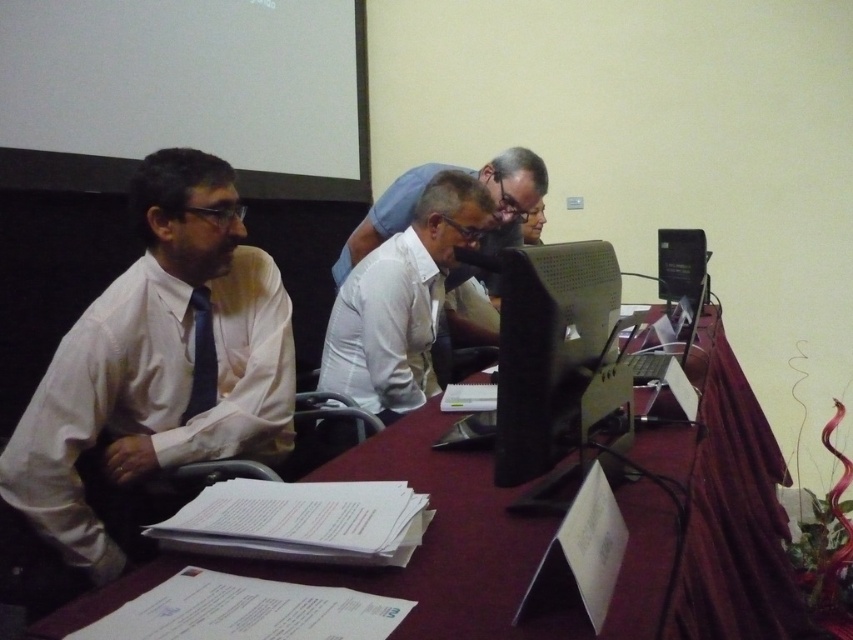
Question: Which of the following is the closest to the observer?

Choices:
 (A) white shirt at center
 (B) white glossy shirt at center

Answer: (A)

Question: Which point is farther to the camera?

Choices:
 (A) (407, 205)
 (B) (343, 340)

Answer: (A)

Question: Is white shirt at center to the right of matte black tie at left from the viewer's perspective?

Choices:
 (A) yes
 (B) no

Answer: (A)

Question: Is matte white shirt at left to the left of black plastic computer at right from the viewer's perspective?

Choices:
 (A) yes
 (B) no

Answer: (A)

Question: Can you confirm if smooth wooden table at center is positioned above matte white shirt at left?

Choices:
 (A) no
 (B) yes

Answer: (A)

Question: Which object is positioned closest to the black plastic monitor at center?

Choices:
 (A) white shirt at center
 (B) black plastic computer at right
 (C) smooth wooden table at center

Answer: (C)